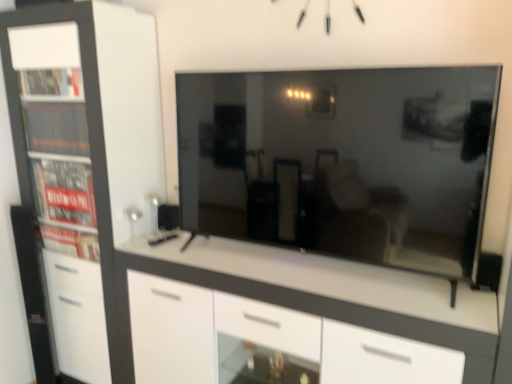
Question: Considering the relative positions of matte black tv at center and white glossy chest of drawers at center in the image provided, is matte black tv at center to the left or to the right of white glossy chest of drawers at center?

Choices:
 (A) right
 (B) left

Answer: (A)

Question: Is point (357, 137) closer or farther from the camera than point (488, 304)?

Choices:
 (A) closer
 (B) farther

Answer: (B)

Question: Estimate the real-world distances between objects in this image. Which object is closer to the white glossy chest of drawers at center?

Choices:
 (A) white matte cabinet at left
 (B) matte black tv at center

Answer: (B)

Question: Which object is positioned farthest from the white glossy chest of drawers at center?

Choices:
 (A) matte black tv at center
 (B) white matte cabinet at left

Answer: (B)